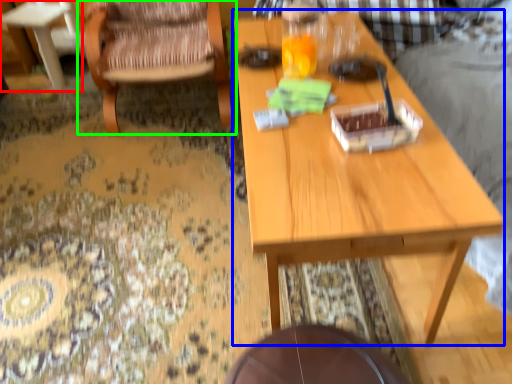
Question: Considering the real-world distances, which object is closest to coffee table (highlighted by a red box)? table (highlighted by a blue box) or chair (highlighted by a green box).

Choices:
 (A) table
 (B) chair

Answer: (B)